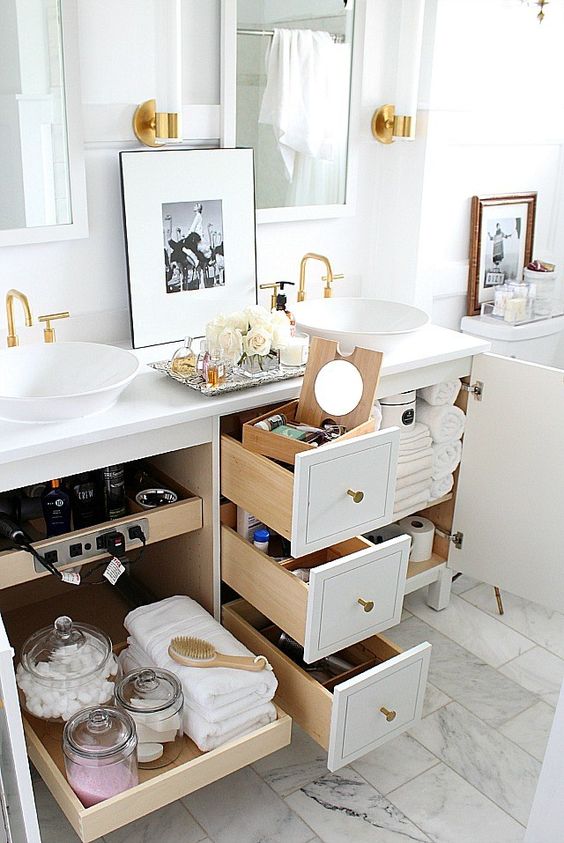
The width and height of the screenshot is (564, 843). In order to click on faucet in this screenshot , I will do `click(26, 315)`, `click(329, 269)`.